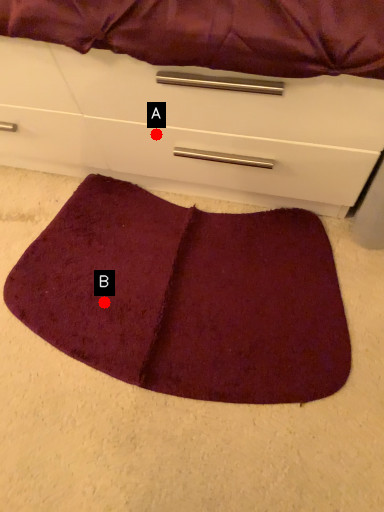
Question: Two points are circled on the image, labeled by A and B beside each circle. Which point appears farthest from the camera in this image?

Choices:
 (A) A is further
 (B) B is further

Answer: (B)